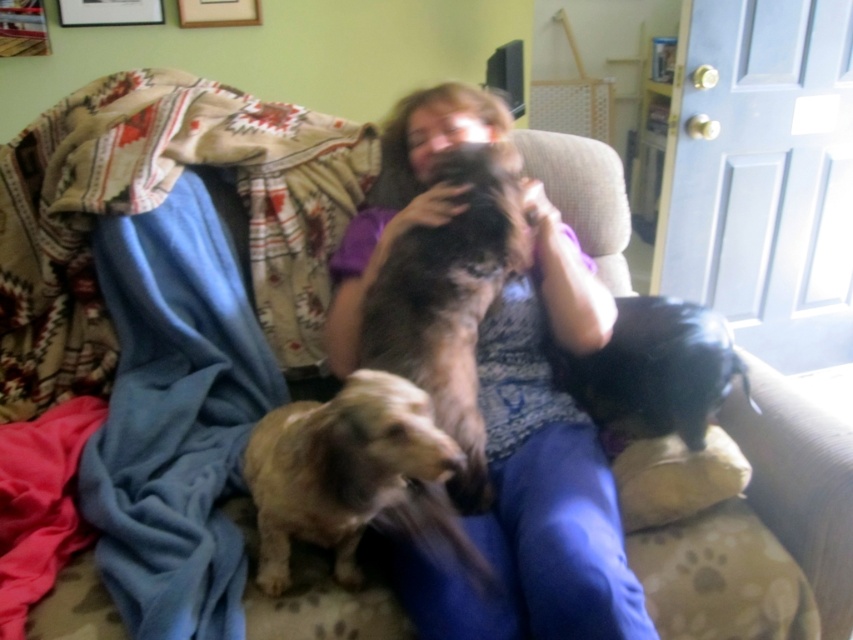
Question: Is brown fur dog at center bigger than black leather dog at lower right?

Choices:
 (A) yes
 (B) no

Answer: (A)

Question: Which point appears closest to the camera in this image?

Choices:
 (A) (459, 445)
 (B) (291, 481)
 (C) (349, 291)
 (D) (683, 376)

Answer: (B)

Question: Considering the real-world distances, which object is closest to the brown fur dog at center?

Choices:
 (A) matte brown dog at center
 (B) black leather dog at lower right

Answer: (A)

Question: Which point appears closest to the camera in this image?

Choices:
 (A) (366, 291)
 (B) (695, 346)

Answer: (B)

Question: Can you confirm if matte brown dog at center is thinner than black leather dog at lower right?

Choices:
 (A) no
 (B) yes

Answer: (A)

Question: Is brown fur dog at center closer to the viewer compared to black leather dog at lower right?

Choices:
 (A) yes
 (B) no

Answer: (A)